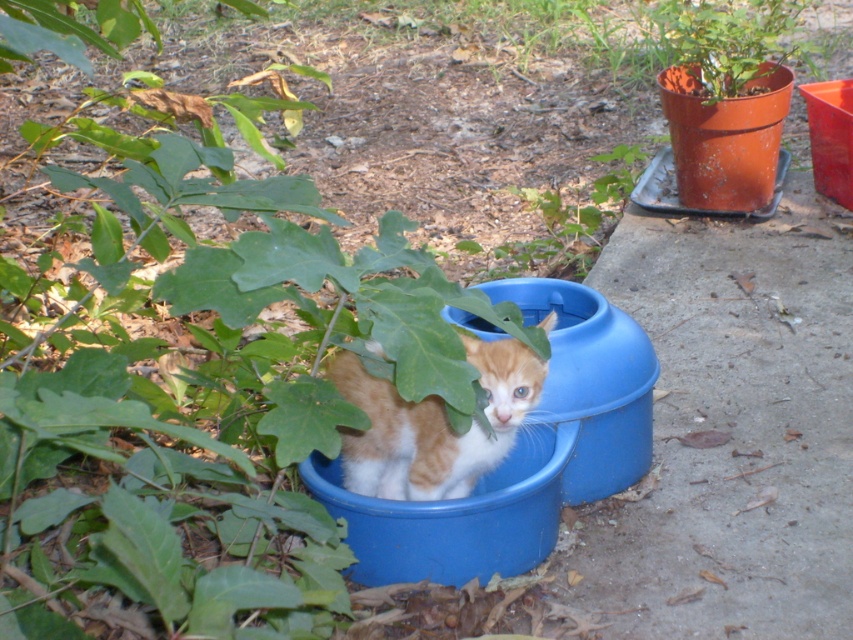
Does matte orange pot at upper right have a greater height compared to green leafy plant at upper center?

Indeed, matte orange pot at upper right has a greater height compared to green leafy plant at upper center.

Looking at this image, can you confirm if matte orange pot at upper right is shorter than green leafy plant at upper center?

No.

This screenshot has width=853, height=640. Find the location of `matte orange pot at upper right`. matte orange pot at upper right is located at coordinates (723, 40).

This screenshot has width=853, height=640. What are the coordinates of `matte orange pot at upper right` in the screenshot? It's located at (723, 40).

In the scene shown: Can you confirm if orange fur kitten at center is wider than matte orange pot at upper right?

No.

What do you see at coordinates (433, 426) in the screenshot?
I see `orange fur kitten at center` at bounding box center [433, 426].

Where is `orange fur kitten at center`? This screenshot has height=640, width=853. orange fur kitten at center is located at coordinates (433, 426).

Can you confirm if orange fur kitten at center is positioned above green leafy plant at upper center?

No.

Can you confirm if orange fur kitten at center is positioned below green leafy plant at upper center?

Correct, orange fur kitten at center is located below green leafy plant at upper center.

Between point (535, 372) and point (628, 180), which one is positioned in front?

Positioned in front is point (535, 372).

This screenshot has height=640, width=853. Identify the location of orange fur kitten at center. (433, 426).